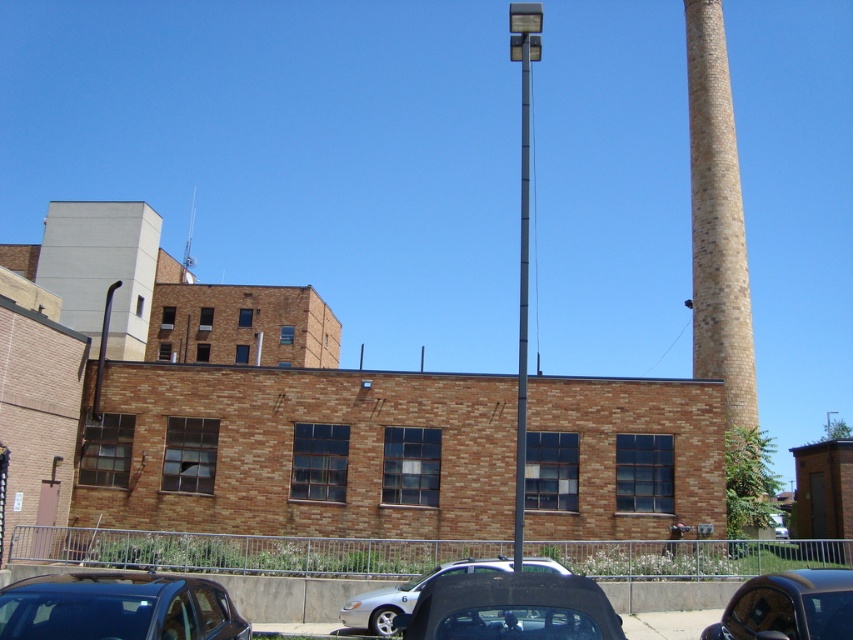
You are a delivery person approaching the brick building and need to park your vehicle. You see a matte black car at lower center and a metallic gray pole at center. Can you safely drive through the space between them?

The matte black car at lower center is in front of the metallic gray pole at center, so there is no space between them for the delivery person to drive through safely.

You are a pedestrian standing in front of the brick building and want to walk to the metallic gray pole at center. Is the matte black car at lower center blocking your path?

The matte black car at lower center is positioned under metallic gray pole at center, so the car is directly in the path leading to the pole. This means the matte black car at lower center is blocking the path to the metallic gray pole at center.

You are standing in front of the brick building and want to park your car. The parking spot you want is behind the low metal fence. Is the shiny black car at lower right blocking your path to the parking spot?

The shiny black car at lower right is located at point 0.926 on the horizontal axis, which means it is positioned near the right edge of the scene. Since the parking spot is behind the fence and the car is at the lower right, it might be blocking your path depending on the exact location of the parking spot. However, without more information about the parking spot position, it is difficult to determine for sure.